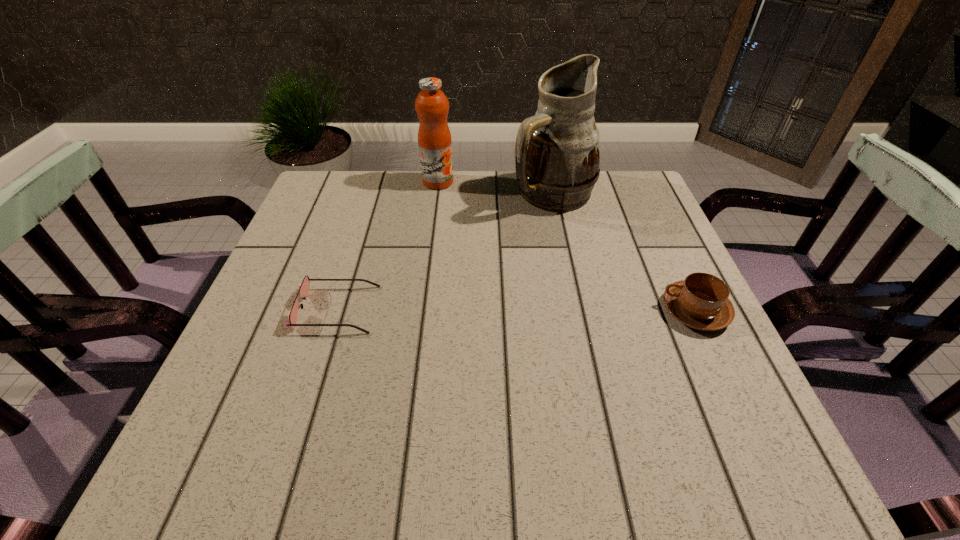
Find the location of `object that is at the left edge`. object that is at the left edge is located at coordinates (304, 287).

Find the location of `cappuccino at the right edge`. cappuccino at the right edge is located at coordinates (701, 301).

I want to click on pitcher that is at the right edge, so click(557, 156).

You are a GUI agent. You are given a task and a screenshot of the screen. Output one action in this format:
    pyautogui.click(x=<x>, y=<y>)
    Task: Click on the object that is positioned at the far right corner
    The width and height of the screenshot is (960, 540).
    Given the screenshot: What is the action you would take?
    pyautogui.click(x=557, y=156)

This screenshot has height=540, width=960. Identify the location of vacant space at the far edge of the desktop. (518, 219).

Where is `vacant space at the near edge of the desktop`? This screenshot has height=540, width=960. vacant space at the near edge of the desktop is located at coordinates (403, 378).

This screenshot has width=960, height=540. Find the location of `vacant space at the left edge of the desktop`. vacant space at the left edge of the desktop is located at coordinates (355, 227).

This screenshot has width=960, height=540. Find the location of `vacant point at the right edge`. vacant point at the right edge is located at coordinates (683, 328).

The width and height of the screenshot is (960, 540). I want to click on vacant space at the far left corner of the desktop, so click(311, 195).

You are a GUI agent. You are given a task and a screenshot of the screen. Output one action in this format:
    pyautogui.click(x=<x>, y=<y>)
    Task: Click on the vacant space at the near left corner of the desktop
    
    Given the screenshot: What is the action you would take?
    pyautogui.click(x=205, y=400)